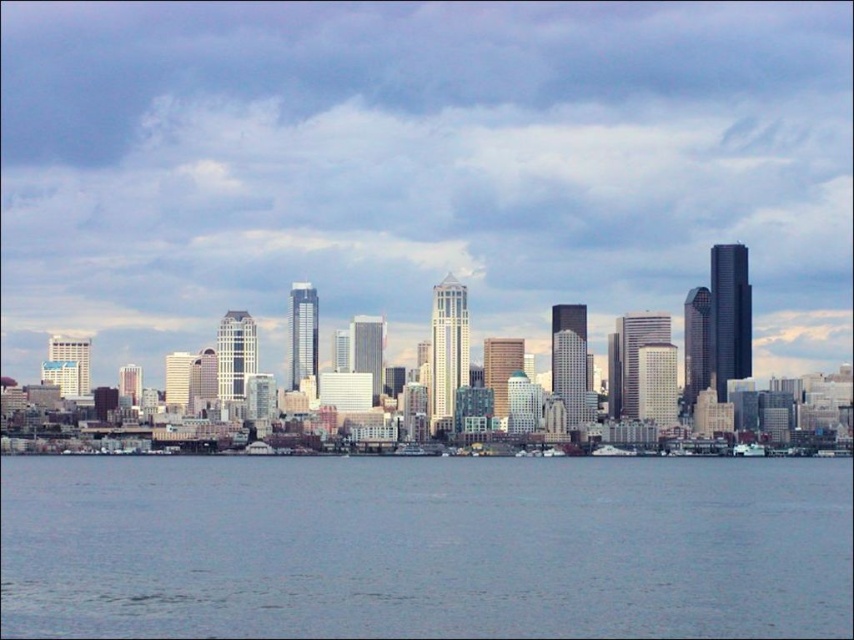
Question: Which object appears closest to the camera in this image?

Choices:
 (A) matte glass skyscrapers at center
 (B) metallic gray boat at lower right
 (C) gray water at lower center

Answer: (A)

Question: Does matte glass skyscrapers at center appear on the right side of gray water at lower center?

Choices:
 (A) no
 (B) yes

Answer: (B)

Question: Estimate the real-world distances between objects in this image. Which object is closer to the gray water at lower center?

Choices:
 (A) white glossy boat at center
 (B) metallic gray boat at lower right

Answer: (A)

Question: Does matte glass skyscrapers at center have a larger size compared to metallic gray boat at lower right?

Choices:
 (A) no
 (B) yes

Answer: (B)

Question: Where is matte glass skyscrapers at center located in relation to gray water at lower center in the image?

Choices:
 (A) right
 (B) left

Answer: (A)

Question: Which object is farther from the camera taking this photo?

Choices:
 (A) gray water at lower center
 (B) white glossy boat at center
 (C) metallic gray boat at lower right
 (D) matte glass skyscrapers at center

Answer: (C)